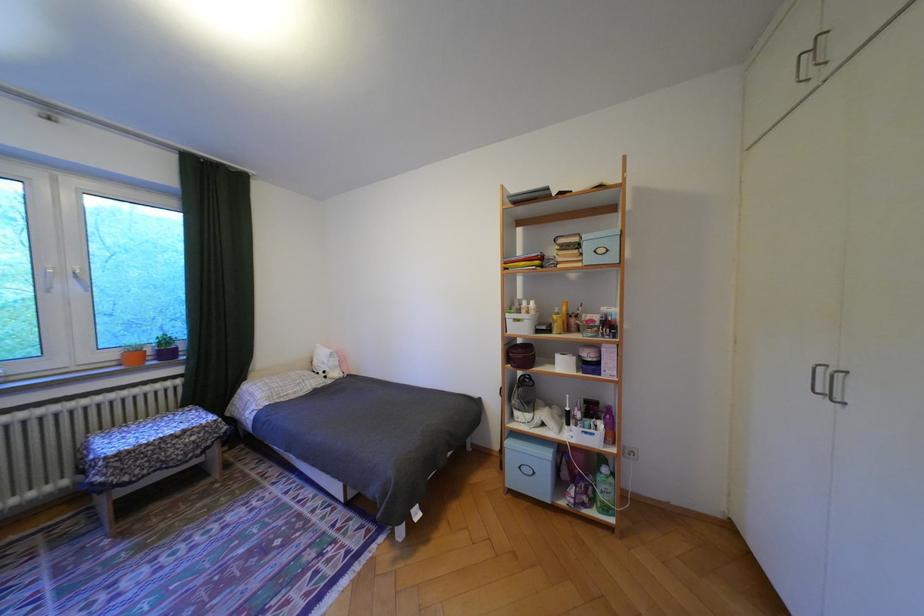
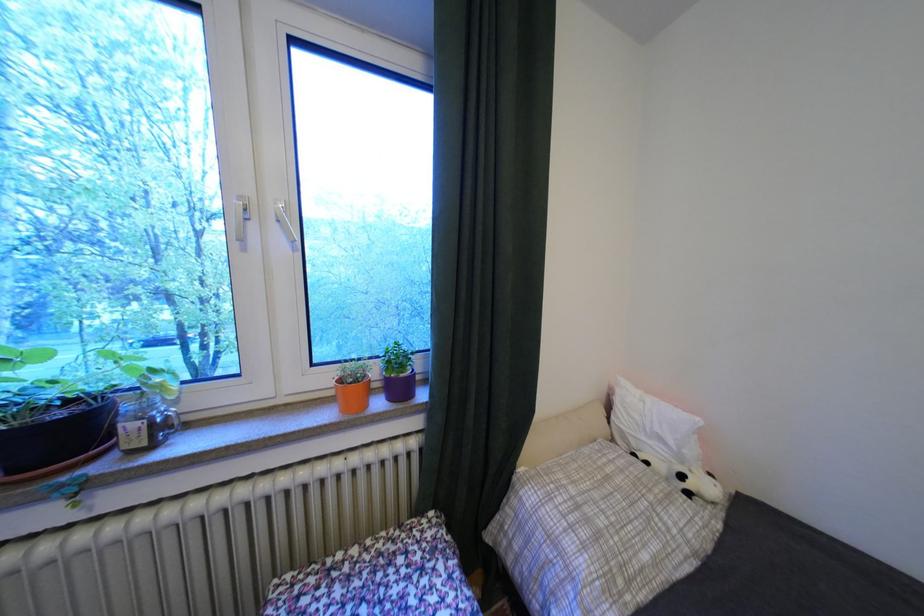
The point at (307, 392) is marked in the first image. Where is the corresponding point in the second image?

(667, 562)